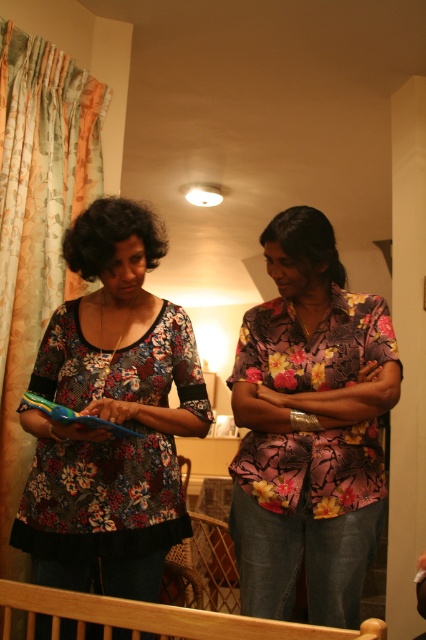
Question: Does floral fabric blouse at center have a smaller size compared to floral fabric curtain at left?

Choices:
 (A) no
 (B) yes

Answer: (B)

Question: Which object appears farthest from the camera in this image?

Choices:
 (A) floral fabric shirt at center
 (B) wooden balustrade at lower center

Answer: (A)

Question: Can you confirm if floral fabric shirt at center is smaller than floral fabric curtain at left?

Choices:
 (A) yes
 (B) no

Answer: (A)

Question: Which of the following is the closest to the observer?

Choices:
 (A) (340, 637)
 (B) (245, 536)
 (C) (11, 230)

Answer: (A)

Question: Which point is closer to the camera?

Choices:
 (A) floral fabric shirt at center
 (B) floral fabric curtain at left

Answer: (A)

Question: Can you confirm if floral fabric blouse at center is smaller than wooden balustrade at lower center?

Choices:
 (A) yes
 (B) no

Answer: (B)